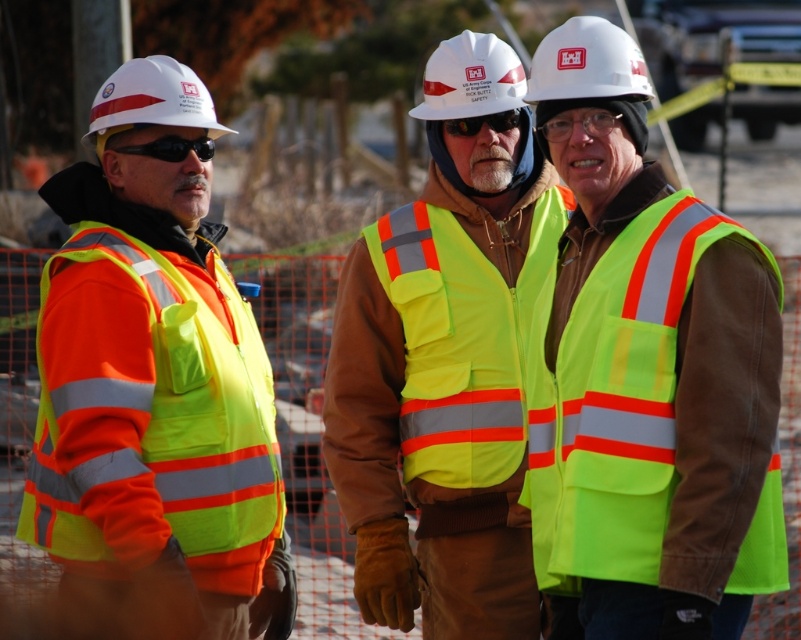
Between high-visibility fabric safety vest at left and black plastic goggles at left, which one has less height?

black plastic goggles at left

Measure the distance between high-visibility fabric safety vest at left and camera.

high-visibility fabric safety vest at left and camera are 10.44 meters apart from each other.

Image resolution: width=801 pixels, height=640 pixels. Find the location of `high-visibility fabric safety vest at left`. high-visibility fabric safety vest at left is located at coordinates (167, 424).

From the picture: Who is more distant from viewer, (630, 596) or (356, 326)?

The point (356, 326) is more distant.

Does neon yellow reflective vest at center have a lesser width compared to high-visibility reflective vest at center?

Yes.

Where is `neon yellow reflective vest at center`? Image resolution: width=801 pixels, height=640 pixels. neon yellow reflective vest at center is located at coordinates (647, 372).

I want to click on neon yellow reflective vest at center, so click(x=647, y=372).

Which is more to the left, high-visibility reflective vest at center or white hard hat at center?

Positioned to the left is high-visibility reflective vest at center.

Where is `high-visibility reflective vest at center`? Image resolution: width=801 pixels, height=640 pixels. high-visibility reflective vest at center is located at coordinates (445, 360).